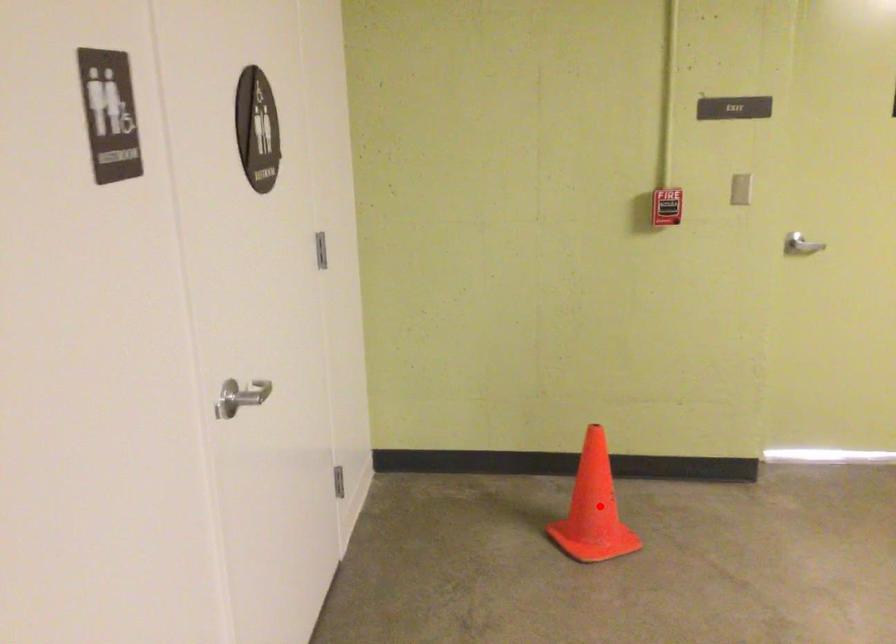
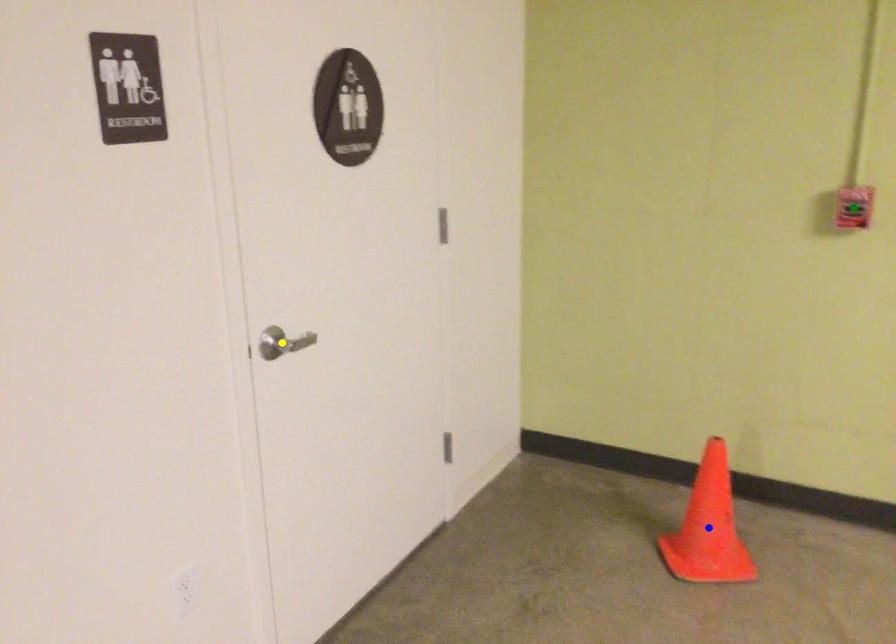
Question: I am providing you with two images of the same scene from different viewpoints. A red point is marked on the first image. You are given multiple points on the second image. Can you choose the point in image 2 that corresponds to the point in image 1?

Choices:
 (A) green point
 (B) yellow point
 (C) blue point

Answer: (C)